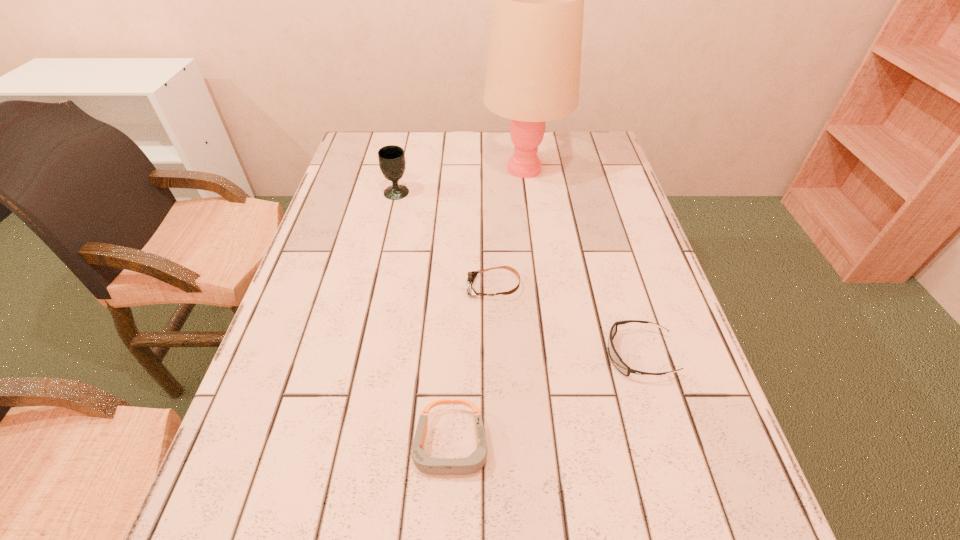
Identify the location of free space located on the lenses of the rightmost goggles. (482, 355).

The image size is (960, 540). Find the location of `vacant area situated on the lenses of the rightmost goggles`. vacant area situated on the lenses of the rightmost goggles is located at coordinates (496, 355).

The image size is (960, 540). I want to click on free space located on the front-facing side of the farthest goggles, so click(x=316, y=287).

You are a GUI agent. You are given a task and a screenshot of the screen. Output one action in this format:
    pyautogui.click(x=<x>, y=<y>)
    Task: Click on the free point located 0.140m on the front-facing side of the farthest goggles
    
    Given the screenshot: What is the action you would take?
    pyautogui.click(x=406, y=287)

The height and width of the screenshot is (540, 960). In order to click on vacant space situated on the front-facing side of the farthest goggles in this screenshot , I will do `click(342, 287)`.

Find the location of a particular element. object located in the far edge section of the desktop is located at coordinates (534, 58).

At what (x,y) coordinates should I click in order to perform the action: click on object at the left edge. Please return your answer as a coordinate pair (x, y). The width and height of the screenshot is (960, 540). Looking at the image, I should click on (392, 162).

Where is `lampshade present at the right edge`? lampshade present at the right edge is located at coordinates click(534, 58).

I want to click on goggles located at the right edge, so click(x=620, y=365).

You are a GUI agent. You are given a task and a screenshot of the screen. Output one action in this format:
    pyautogui.click(x=<x>, y=<y>)
    Task: Click on the object present at the far right corner
    This screenshot has height=540, width=960.
    Given the screenshot: What is the action you would take?
    pyautogui.click(x=534, y=58)